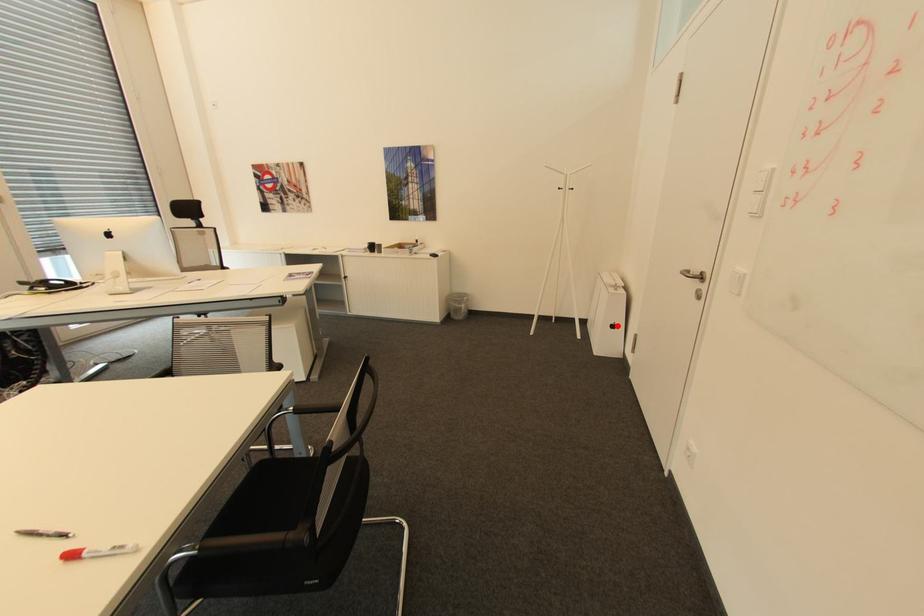
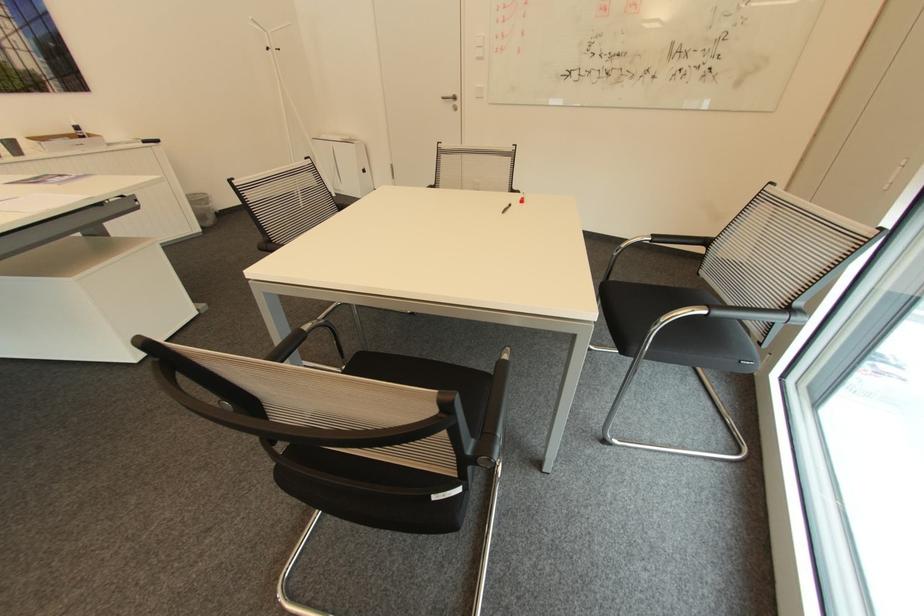
Question: I am providing you with two images of the same scene from different viewpoints. Given a red point in image1, look at the same physical point in image2. Is it:

Choices:
 (A) Closer to the viewpoint
 (B) Farther from the viewpoint

Answer: (B)